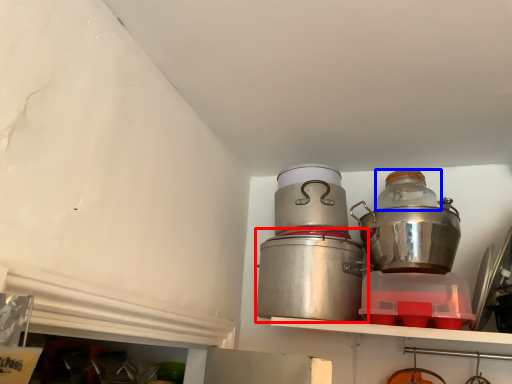
Question: Among these objects, which one is nearest to the camera, crock pot (highlighted by a red box) or bottle (highlighted by a blue box)?

Choices:
 (A) crock pot
 (B) bottle

Answer: (A)